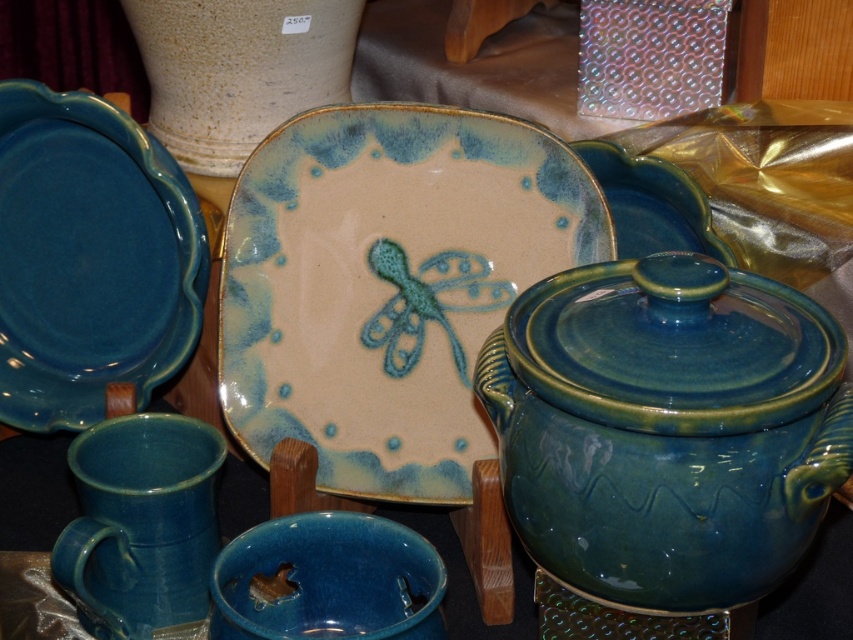
Question: Which point appears farthest from the camera in this image?

Choices:
 (A) (379, 634)
 (B) (120, 250)

Answer: (B)

Question: Does blue glossy teapot at right appear under matte blue bowl at center?

Choices:
 (A) yes
 (B) no

Answer: (B)

Question: Which object appears closest to the camera in this image?

Choices:
 (A) matte blue bowl at center
 (B) speckled ceramic vase at upper center
 (C) matte ceramic plate at center

Answer: (A)

Question: Is matte ceramic plate at center further to the viewer compared to speckled ceramic vase at upper center?

Choices:
 (A) no
 (B) yes

Answer: (A)

Question: Among these points, which one is farthest from the camera?

Choices:
 (A) (142, 250)
 (B) (703, 595)
 (C) (184, 417)
 (D) (563, 236)

Answer: (A)

Question: Can you confirm if matte ceramic plate at center is positioned above blue glossy teapot at right?

Choices:
 (A) no
 (B) yes

Answer: (B)